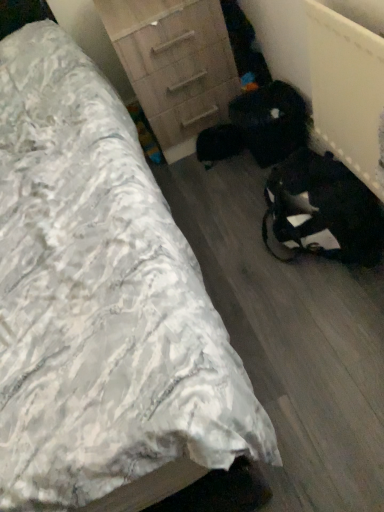
Question: Is white textured bed at center outside wooden chest of drawers at center?

Choices:
 (A) yes
 (B) no

Answer: (A)

Question: Does white textured bed at center have a greater height compared to wooden chest of drawers at center?

Choices:
 (A) no
 (B) yes

Answer: (B)

Question: From the image's perspective, does white textured bed at center appear higher than wooden chest of drawers at center?

Choices:
 (A) no
 (B) yes

Answer: (A)

Question: From the image's perspective, is white textured bed at center under wooden chest of drawers at center?

Choices:
 (A) yes
 (B) no

Answer: (A)

Question: From a real-world perspective, is white textured bed at center physically above wooden chest of drawers at center?

Choices:
 (A) yes
 (B) no

Answer: (A)

Question: Is white textured bed at center at the left side of wooden chest of drawers at center?

Choices:
 (A) yes
 (B) no

Answer: (A)

Question: Does wooden chest of drawers at center have a greater height compared to white textured bed at center?

Choices:
 (A) no
 (B) yes

Answer: (A)

Question: Is wooden chest of drawers at center directly adjacent to white textured bed at center?

Choices:
 (A) yes
 (B) no

Answer: (B)

Question: Is wooden chest of drawers at center behind white textured bed at center?

Choices:
 (A) yes
 (B) no

Answer: (A)

Question: Can you confirm if wooden chest of drawers at center is wider than white textured bed at center?

Choices:
 (A) yes
 (B) no

Answer: (B)

Question: Does wooden chest of drawers at center have a smaller size compared to white textured bed at center?

Choices:
 (A) yes
 (B) no

Answer: (A)

Question: From the image's perspective, is wooden chest of drawers at center located above white textured bed at center?

Choices:
 (A) yes
 (B) no

Answer: (A)

Question: In terms of size, does wooden chest of drawers at center appear bigger or smaller than white textured bed at center?

Choices:
 (A) big
 (B) small

Answer: (B)